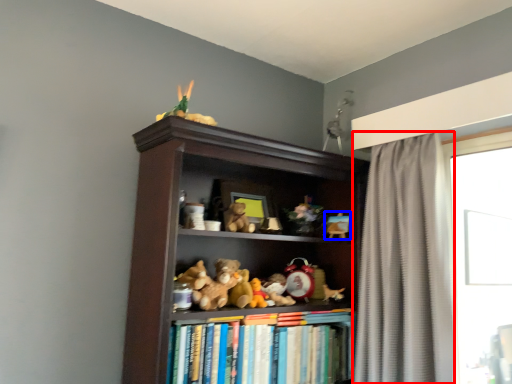
Question: Which of the following is the closest to the observer, curtain (highlighted by a red box) or toy (highlighted by a blue box)?

Choices:
 (A) curtain
 (B) toy

Answer: (A)